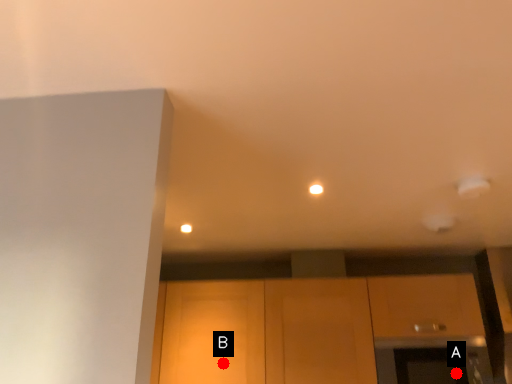
Question: Two points are circled on the image, labeled by A and B beside each circle. Which point is farther to the camera?

Choices:
 (A) A is further
 (B) B is further

Answer: (B)